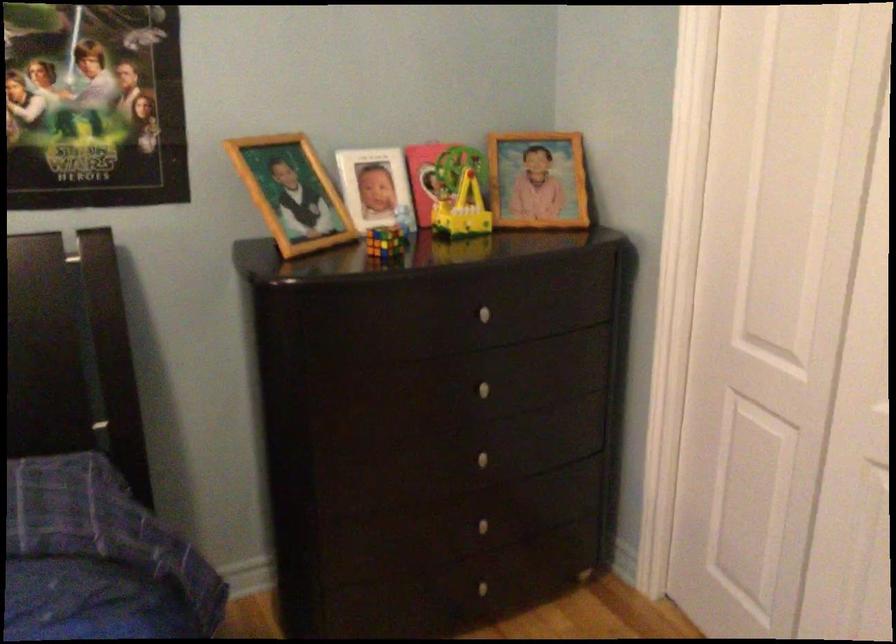
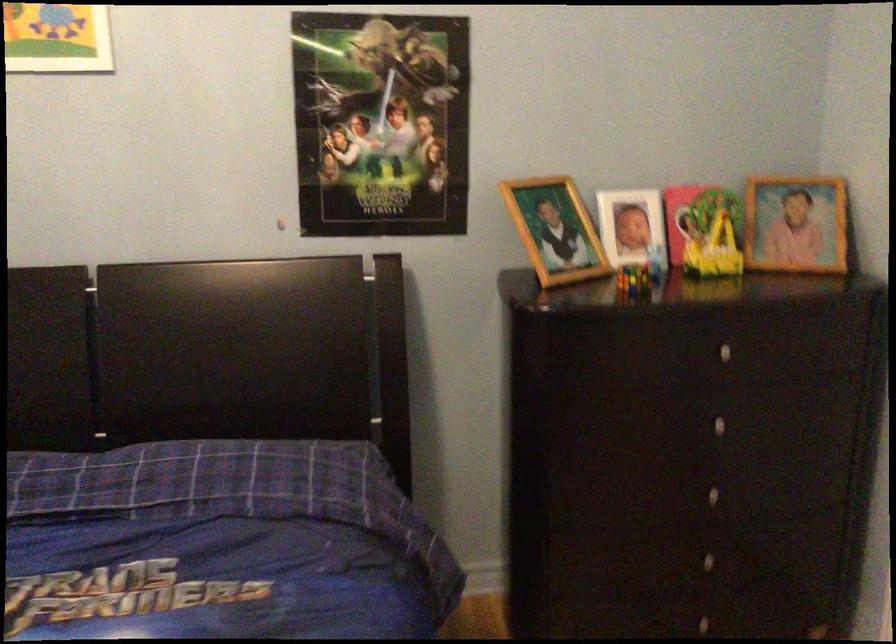
In the second image, find the point that corresponds to pixel 485 480 in the first image.

(711, 516)